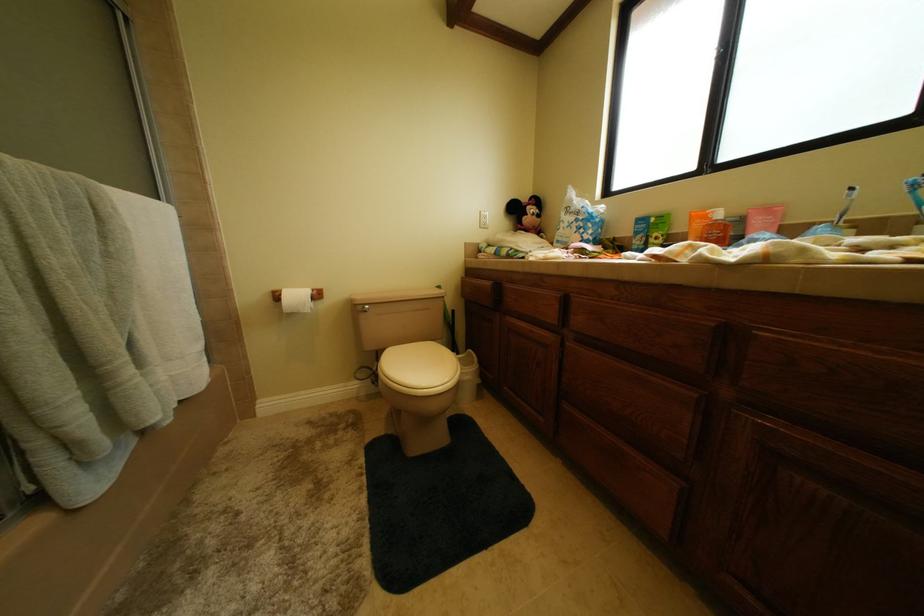
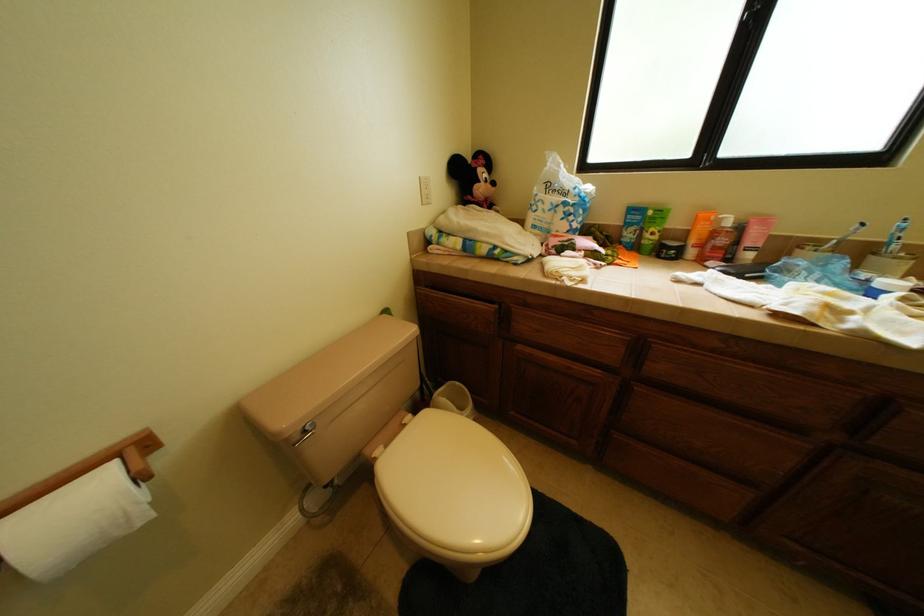
How did the camera likely rotate?

The camera's rotation is toward right-down.